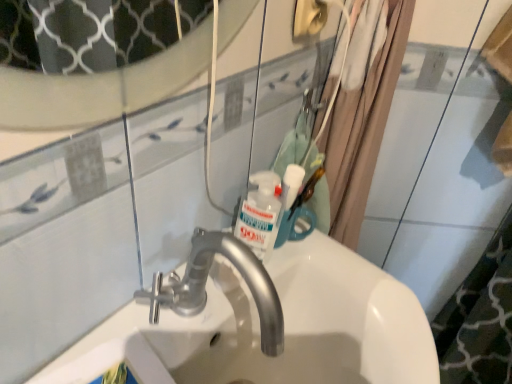
The image size is (512, 384). What do you see at coordinates (276, 329) in the screenshot?
I see `white glossy sink at center` at bounding box center [276, 329].

I want to click on white glossy mouthwash at upper center, so click(x=289, y=201).

Considering the points (372, 19) and (215, 260), which point is in front, point (372, 19) or point (215, 260)?

Positioned in front is point (215, 260).

You are a GUI agent. You are given a task and a screenshot of the screen. Output one action in this format:
    pyautogui.click(x=<x>, y=<y>)
    Task: Click on the sink on the left of beige fabric shower curtain at upper right
    
    Given the screenshot: What is the action you would take?
    pyautogui.click(x=276, y=329)

How many degrees apart are the facing directions of beige fabric shower curtain at upper right and white glossy sink at center?

55.7 degrees.

Measure the distance from white glossy sink at center to white glossy mouthwash at upper center.

They are 7.23 inches apart.

From a real-world perspective, is white glossy sink at center on top of white glossy mouthwash at upper center?

No, from a real-world perspective, white glossy sink at center is not on top of white glossy mouthwash at upper center.

Is white glossy sink at center taller than white glossy mouthwash at upper center?

Correct, white glossy sink at center is much taller as white glossy mouthwash at upper center.

Does white glossy sink at center have a lesser width compared to white glossy mouthwash at upper center?

No.

Considering their positions, is white glossy mouthwash at upper center located in front of or behind white glossy sink at center?

white glossy mouthwash at upper center is positioned farther from the viewer than white glossy sink at center.

From the image's perspective, between white glossy mouthwash at upper center and white glossy sink at center, which one is located above?

white glossy mouthwash at upper center appears higher in the image.

From their relative heights in the image, would you say white glossy mouthwash at upper center is taller or shorter than white glossy sink at center?

Considering their sizes, white glossy mouthwash at upper center has less height than white glossy sink at center.

Are white glossy mouthwash at upper center and white glossy sink at center far apart?

Actually, white glossy mouthwash at upper center and white glossy sink at center are a little close together.

Does beige fabric shower curtain at upper right have a greater width compared to white glossy mouthwash at upper center?

Indeed, beige fabric shower curtain at upper right has a greater width compared to white glossy mouthwash at upper center.

From the image's perspective, is beige fabric shower curtain at upper right on white glossy mouthwash at upper center?

Yes, from the image's perspective, beige fabric shower curtain at upper right is above white glossy mouthwash at upper center.

In the scene shown: Would you say beige fabric shower curtain at upper right is a long distance from white glossy mouthwash at upper center?

Actually, beige fabric shower curtain at upper right and white glossy mouthwash at upper center are a little close together.

Which is behind, point (379, 104) or point (300, 183)?

The point (379, 104) is farther from the camera.

Where is `shower curtain above the white glossy sink at center (from a real-world perspective)`? The image size is (512, 384). shower curtain above the white glossy sink at center (from a real-world perspective) is located at coordinates (362, 110).

Are white glossy sink at center and beige fabric shower curtain at upper right located far from each other?

No, white glossy sink at center is not far from beige fabric shower curtain at upper right.

Between white glossy sink at center and beige fabric shower curtain at upper right, which one appears on the left side from the viewer's perspective?

Positioned to the left is white glossy sink at center.

Could you tell me if white glossy sink at center is turned towards beige fabric shower curtain at upper right?

No, white glossy sink at center is not turned towards beige fabric shower curtain at upper right.

Considering the sizes of objects white glossy mouthwash at upper center and beige fabric shower curtain at upper right in the image provided, who is thinner, white glossy mouthwash at upper center or beige fabric shower curtain at upper right?

Thinner between the two is white glossy mouthwash at upper center.

Does white glossy mouthwash at upper center contain beige fabric shower curtain at upper right?

Definitely not — beige fabric shower curtain at upper right is not inside white glossy mouthwash at upper center.

Identify the location of shower curtain to the right of white glossy mouthwash at upper center. The image size is (512, 384). coord(362,110).

Locate an element on the screen. This screenshot has height=384, width=512. shower curtain that is on the right side of white glossy sink at center is located at coordinates (x=362, y=110).

The height and width of the screenshot is (384, 512). In order to click on sink in front of the white glossy mouthwash at upper center in this screenshot , I will do `click(276, 329)`.

Estimate the real-world distances between objects in this image. Which object is further from white glossy mouthwash at upper center, white glossy sink at center or beige fabric shower curtain at upper right?

Based on the image, beige fabric shower curtain at upper right appears to be further to white glossy mouthwash at upper center.

When comparing their distances from white glossy sink at center, does white glossy mouthwash at upper center or beige fabric shower curtain at upper right seem closer?

The object closer to white glossy sink at center is white glossy mouthwash at upper center.

Estimate the real-world distances between objects in this image. Which object is closer to beige fabric shower curtain at upper right, white glossy sink at center or white glossy mouthwash at upper center?

white glossy mouthwash at upper center.

Based on their spatial positions, is beige fabric shower curtain at upper right or white glossy mouthwash at upper center further from white glossy sink at center?

Among the two, beige fabric shower curtain at upper right is located further to white glossy sink at center.

Which object lies nearer to the anchor point beige fabric shower curtain at upper right, white glossy mouthwash at upper center or white glossy sink at center?

Based on the image, white glossy mouthwash at upper center appears to be nearer to beige fabric shower curtain at upper right.

Estimate the real-world distances between objects in this image. Which object is closer to white glossy mouthwash at upper center, beige fabric shower curtain at upper right or white glossy sink at center?

white glossy sink at center is positioned closer to the anchor white glossy mouthwash at upper center.

Where is `mouthwash between beige fabric shower curtain at upper right and white glossy sink at center in the vertical direction`? The image size is (512, 384). mouthwash between beige fabric shower curtain at upper right and white glossy sink at center in the vertical direction is located at coordinates (289, 201).